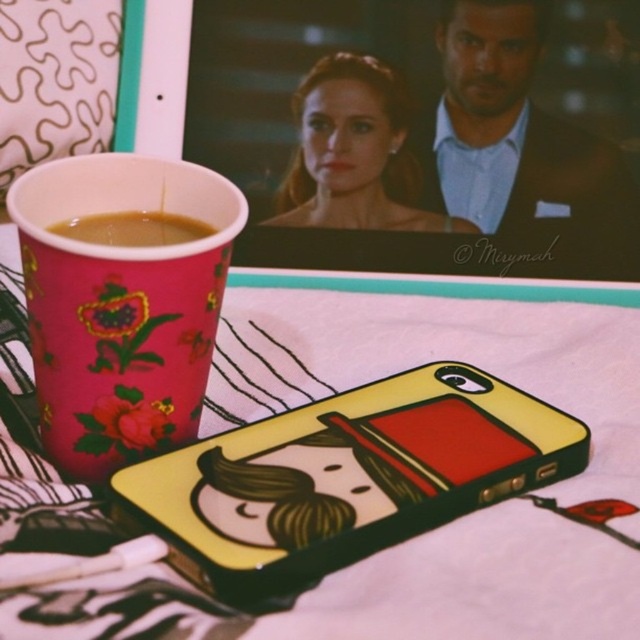
You are trying to reach the tablet in the background but there are two points blocking your view. The points are labeled as point [308,496] and point [74,282]. Which point is closer to you, making it the first obstacle?

Point [74,282] is closer to you, so it is the first obstacle you encounter before reaching the tablet.

You are organizing items on a table and need to place the yellow matte phone case at center and the pink paper cup at left. If you want to stack them vertically, which one should go on the bottom to ensure stability?

The yellow matte phone case at center is not as tall as the pink paper cup at left, so to ensure stability when stacking, the taller pink paper cup at left should be placed on the bottom, and the shorter yellow matte phone case at center on top.